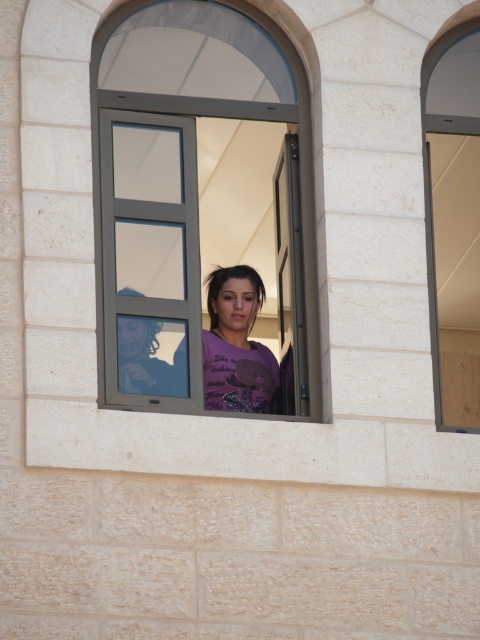
You are standing outside the building looking at the large arched window. There are two points marked on the window frame, one at coordinates point (275, 243) and the other at point (430, 93). Which point is closer to you?

Point (430, 93) is closer to you because it is less further to the camera than point (275, 243).